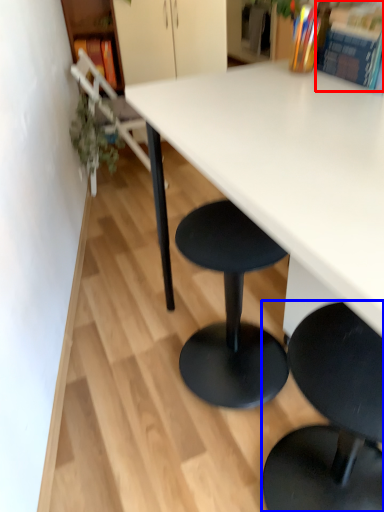
Question: Which object appears farthest to the camera in this image, book (highlighted by a red box) or chair (highlighted by a blue box)?

Choices:
 (A) book
 (B) chair

Answer: (A)